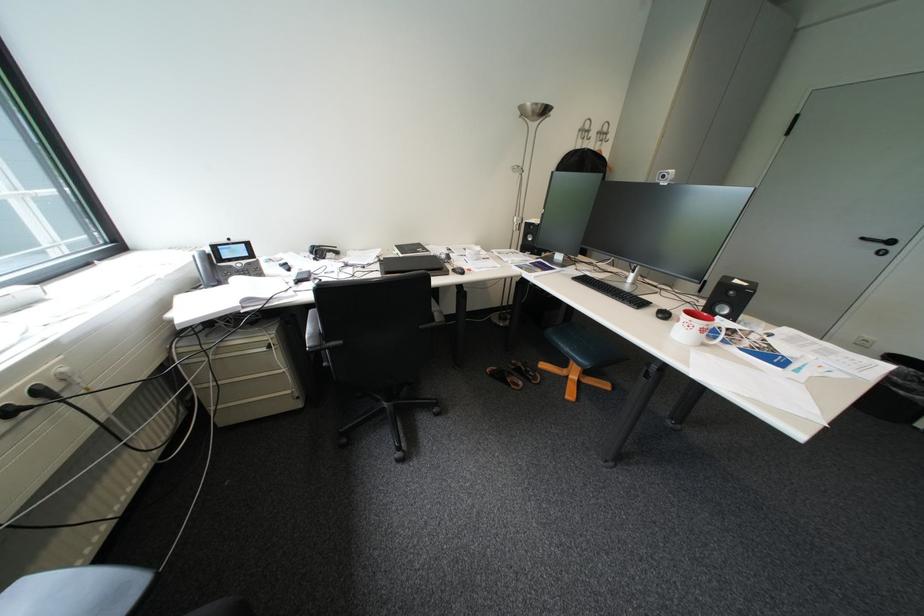
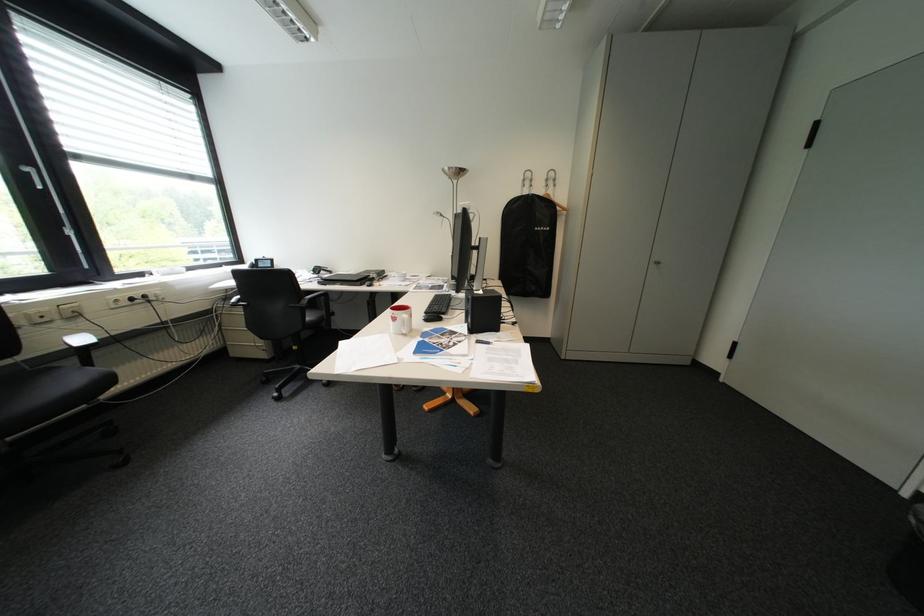
Question: In a continuous first-person perspective shot, in which direction is the camera moving?

Choices:
 (A) Left
 (B) Right
 (C) Forward
 (D) Backward

Answer: (B)